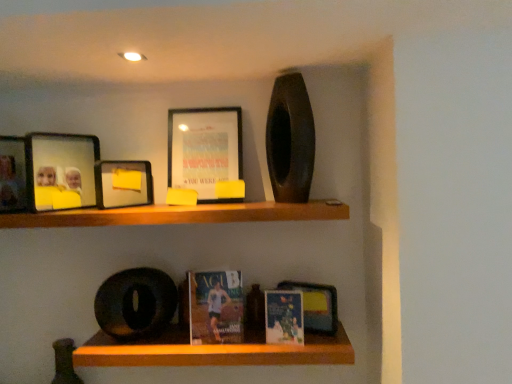
Question: From the image's perspective, is matte black picture frame at upper center, the fourth picture frame from the left, over wooden shelf at lower center, placed as the 2th shelf when sorted from top to bottom?

Choices:
 (A) no
 (B) yes

Answer: (B)

Question: Is matte black picture frame at upper center, the 1th picture frame viewed from the right, turned away from wooden shelf at lower center, placed as the 2th shelf when sorted from top to bottom?

Choices:
 (A) no
 (B) yes

Answer: (A)

Question: Is matte black picture frame at upper center, the fourth picture frame from the left, with wooden shelf at lower center, placed as the 2th shelf when sorted from top to bottom?

Choices:
 (A) no
 (B) yes

Answer: (A)

Question: Can you confirm if matte black picture frame at upper center, the 1th picture frame viewed from the right, is positioned to the left of wooden shelf at lower center, which is the first shelf from bottom to top?

Choices:
 (A) yes
 (B) no

Answer: (A)

Question: Does matte black picture frame at upper center, the fourth picture frame from the left, lie in front of wooden shelf at lower center, which is the first shelf from bottom to top?

Choices:
 (A) no
 (B) yes

Answer: (A)

Question: Is matte black picture frame at upper center, the 1th picture frame viewed from the right, shorter than wooden shelf at lower center, which is the first shelf from bottom to top?

Choices:
 (A) no
 (B) yes

Answer: (A)

Question: Is matte glass photo frame at upper left, positioned as the 3th picture frame in right-to-left order, to the left of matte black picture frame at upper center, the fourth picture frame from the left, from the viewer's perspective?

Choices:
 (A) no
 (B) yes

Answer: (B)

Question: From a real-world perspective, is matte glass photo frame at upper left, the second picture frame when ordered from left to right, located higher than matte black picture frame at upper center, the fourth picture frame from the left?

Choices:
 (A) no
 (B) yes

Answer: (A)

Question: Does matte glass photo frame at upper left, the second picture frame when ordered from left to right, have a lesser height compared to matte black picture frame at upper center, the 1th picture frame viewed from the right?

Choices:
 (A) yes
 (B) no

Answer: (A)

Question: Is matte glass photo frame at upper left, positioned as the 3th picture frame in right-to-left order, positioned behind matte black picture frame at upper center, the fourth picture frame from the left?

Choices:
 (A) no
 (B) yes

Answer: (A)

Question: Considering the relative sizes of matte glass photo frame at upper left, positioned as the 3th picture frame in right-to-left order, and matte black picture frame at upper center, the fourth picture frame from the left, in the image provided, is matte glass photo frame at upper left, positioned as the 3th picture frame in right-to-left order, smaller than matte black picture frame at upper center, the fourth picture frame from the left,?

Choices:
 (A) yes
 (B) no

Answer: (A)

Question: Considering the relative positions of matte glass photo frame at upper left, positioned as the 3th picture frame in right-to-left order, and matte black picture frame at upper center, the fourth picture frame from the left, in the image provided, is matte glass photo frame at upper left, positioned as the 3th picture frame in right-to-left order, to the right of matte black picture frame at upper center, the fourth picture frame from the left, from the viewer's perspective?

Choices:
 (A) yes
 (B) no

Answer: (B)

Question: Is matte paper book at center, acting as the first paperback book starting from the right, taller than wooden shelf at upper center, arranged as the first shelf when viewed from the top?

Choices:
 (A) yes
 (B) no

Answer: (A)